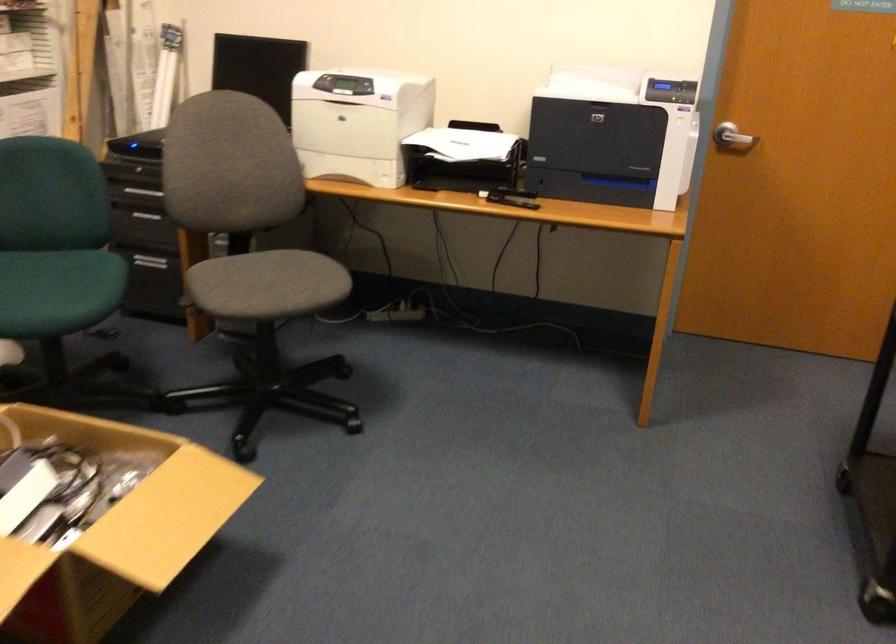
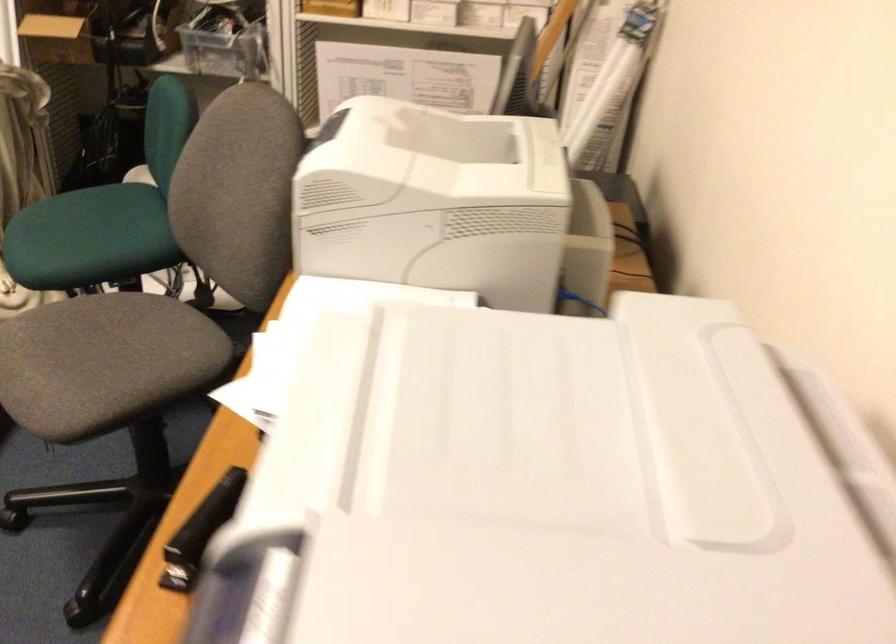
Where in the second image is the point corresponding to (626,80) from the first image?

(593, 491)